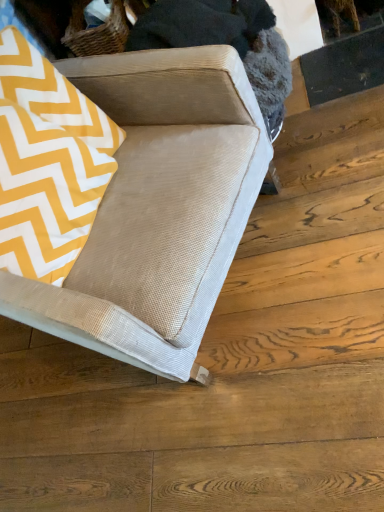
Question: Considering the relative positions of yellow zigzag fabric at upper left and beige corduroy couch at center in the image provided, is yellow zigzag fabric at upper left in front of beige corduroy couch at center?

Choices:
 (A) yes
 (B) no

Answer: (B)

Question: Is yellow zigzag fabric at upper left surrounding beige corduroy couch at center?

Choices:
 (A) no
 (B) yes

Answer: (A)

Question: Considering the relative sizes of yellow zigzag fabric at upper left and beige corduroy couch at center in the image provided, is yellow zigzag fabric at upper left smaller than beige corduroy couch at center?

Choices:
 (A) yes
 (B) no

Answer: (A)

Question: From a real-world perspective, is yellow zigzag fabric at upper left located higher than beige corduroy couch at center?

Choices:
 (A) yes
 (B) no

Answer: (A)

Question: Are yellow zigzag fabric at upper left and beige corduroy couch at center far apart?

Choices:
 (A) no
 (B) yes

Answer: (A)

Question: From the image's perspective, is yellow zigzag fabric at upper left below beige corduroy couch at center?

Choices:
 (A) no
 (B) yes

Answer: (A)

Question: Is beige corduroy couch at center smaller than yellow zigzag fabric at upper left?

Choices:
 (A) no
 (B) yes

Answer: (A)

Question: From the image's perspective, is beige corduroy couch at center over yellow zigzag fabric at upper left?

Choices:
 (A) yes
 (B) no

Answer: (B)

Question: Could you tell me if beige corduroy couch at center is facing yellow zigzag fabric at upper left?

Choices:
 (A) no
 (B) yes

Answer: (A)

Question: Is beige corduroy couch at center in front of yellow zigzag fabric at upper left?

Choices:
 (A) no
 (B) yes

Answer: (B)

Question: Would you say beige corduroy couch at center is a long distance from yellow zigzag fabric at upper left?

Choices:
 (A) yes
 (B) no

Answer: (B)

Question: From the image's perspective, is beige corduroy couch at center located beneath yellow zigzag fabric at upper left?

Choices:
 (A) no
 (B) yes

Answer: (B)

Question: Is point (46, 84) positioned closer to the camera than point (61, 91)?

Choices:
 (A) farther
 (B) closer

Answer: (B)